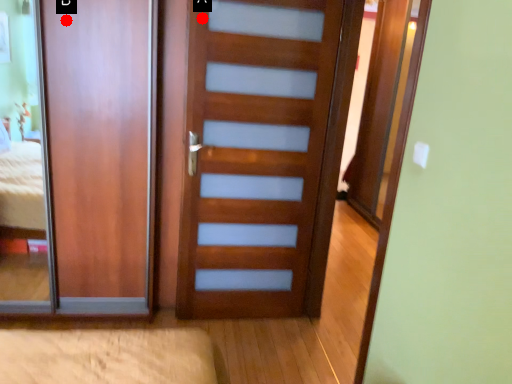
Question: Two points are circled on the image, labeled by A and B beside each circle. Which point is closer to the camera?

Choices:
 (A) A is closer
 (B) B is closer

Answer: (B)